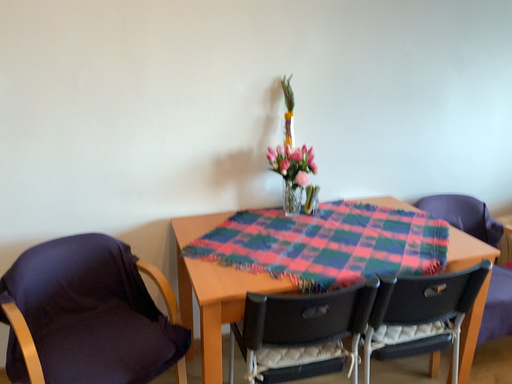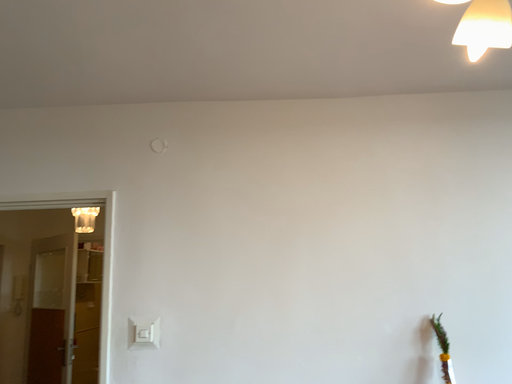
Question: How did the camera likely rotate when shooting the video?

Choices:
 (A) rotated left
 (B) rotated right

Answer: (A)